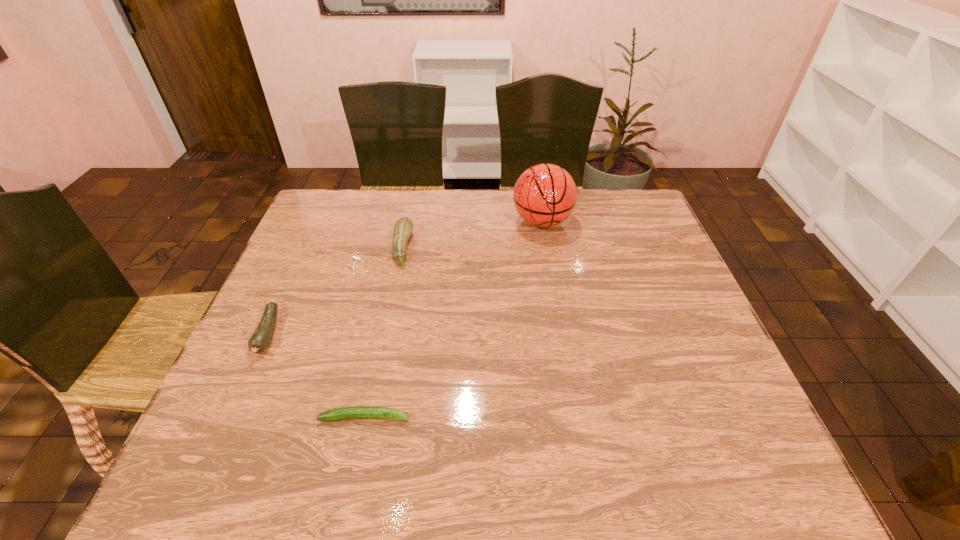
What are the coordinates of `vacant space located at the blossom end of the second nearest zucchini` in the screenshot? It's located at (214, 455).

You are a GUI agent. You are given a task and a screenshot of the screen. Output one action in this format:
    pyautogui.click(x=<x>, y=<y>)
    Task: Click on the blank area located on the front-facing side of the nearest object
    The height and width of the screenshot is (540, 960).
    Given the screenshot: What is the action you would take?
    pyautogui.click(x=598, y=417)

At what (x,y) coordinates should I click in order to perform the action: click on basketball located at the far edge. Please return your answer as a coordinate pair (x, y). This screenshot has height=540, width=960. Looking at the image, I should click on (545, 195).

Identify the location of zucchini that is at the far edge. This screenshot has width=960, height=540. (403, 228).

The image size is (960, 540). What are the coordinates of `object located in the left edge section of the desktop` in the screenshot? It's located at (262, 336).

I want to click on free space at the far edge of the desktop, so click(x=476, y=201).

At what (x,y) coordinates should I click in order to perform the action: click on free space at the near edge of the desktop. Please return your answer as a coordinate pair (x, y). Looking at the image, I should click on [x=403, y=450].

In the image, there is a desktop. Where is `vacant space at the left edge`? vacant space at the left edge is located at coordinates (300, 232).

In the image, there is a desktop. Identify the location of vacant space at the right edge. (759, 433).

This screenshot has height=540, width=960. Identify the location of vacant region at the far right corner of the desktop. (615, 211).